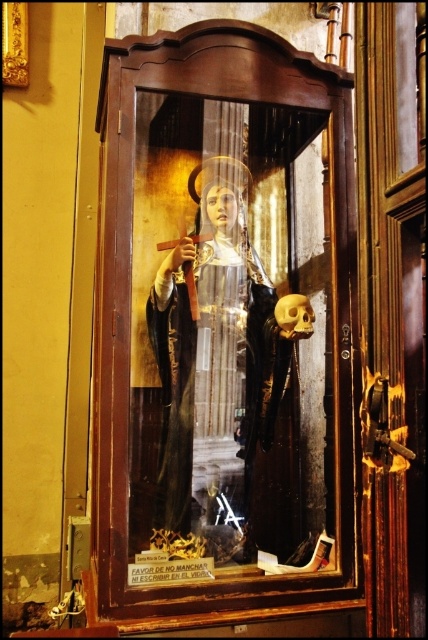
Question: Does wooden cabinet at center appear on the right side of matte black robe at center?

Choices:
 (A) no
 (B) yes

Answer: (A)

Question: Among these points, which one is nearest to the camera?

Choices:
 (A) (278, 381)
 (B) (127, 241)

Answer: (B)

Question: Among these objects, which one is nearest to the camera?

Choices:
 (A) matte black robe at center
 (B) wooden cabinet at center

Answer: (B)

Question: Does wooden cabinet at center appear on the right side of matte black robe at center?

Choices:
 (A) yes
 (B) no

Answer: (B)

Question: Among these points, which one is nearest to the camera?

Choices:
 (A) (234, 508)
 (B) (299, 516)

Answer: (A)

Question: Is wooden cabinet at center bigger than matte black robe at center?

Choices:
 (A) yes
 (B) no

Answer: (A)